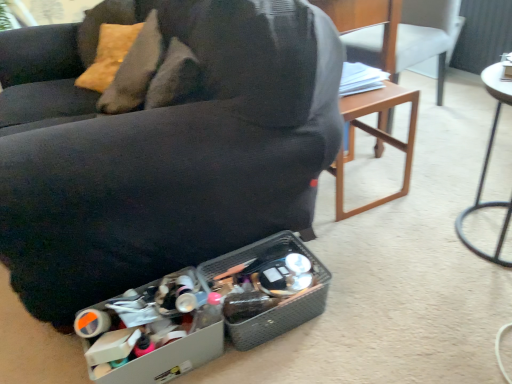
Question: From a real-world perspective, relative to matte black couch at center, placed as the first chair when sorted from left to right, is metallic silver table at right vertically above or below?

Choices:
 (A) above
 (B) below

Answer: (B)

Question: In terms of height, does metallic silver table at right look taller or shorter compared to matte black couch at center, placed as the 2th chair when sorted from right to left?

Choices:
 (A) short
 (B) tall

Answer: (A)

Question: Considering the real-world distances, which object is closest to the wooden chair at right, positioned as the first chair in right-to-left order?

Choices:
 (A) matte black couch at center, placed as the 2th chair when sorted from right to left
 (B) metallic silver table at right

Answer: (B)

Question: Considering the real-world distances, which object is farthest from the metallic silver table at right?

Choices:
 (A) matte black couch at center, placed as the first chair when sorted from left to right
 (B) wooden chair at right, which is counted as the second chair, starting from the left

Answer: (A)